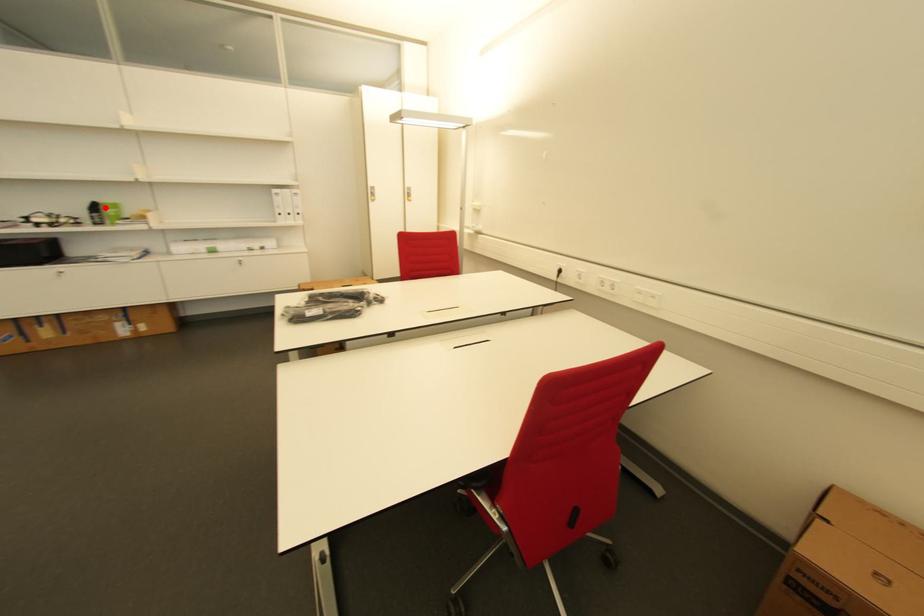
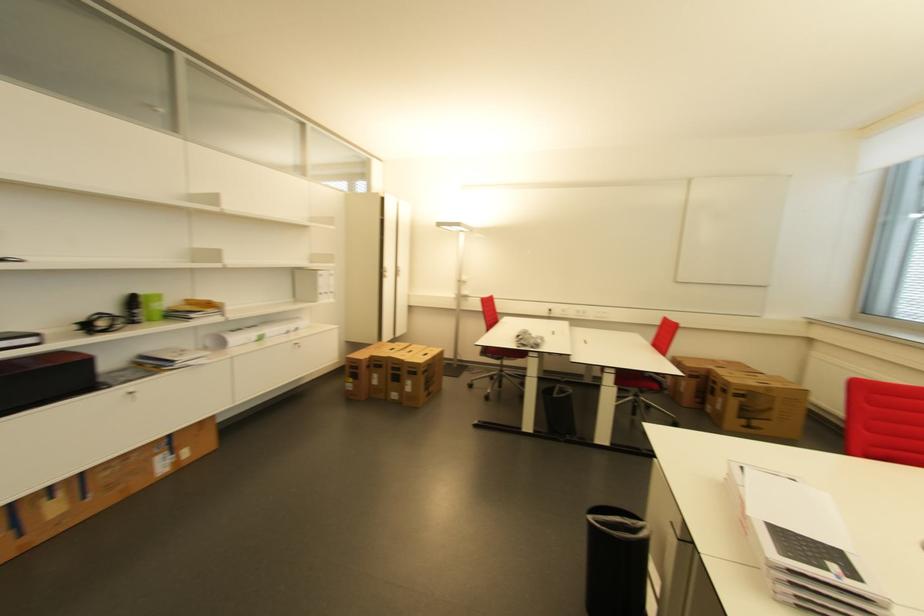
Find the pixel in the second image that matches the highlighted location in the first image.

(147, 301)